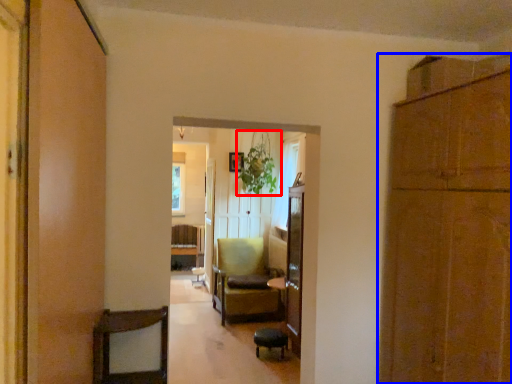
Question: Which object is closer to the camera taking this photo, plant (highlighted by a red box) or cabinetry (highlighted by a blue box)?

Choices:
 (A) plant
 (B) cabinetry

Answer: (B)